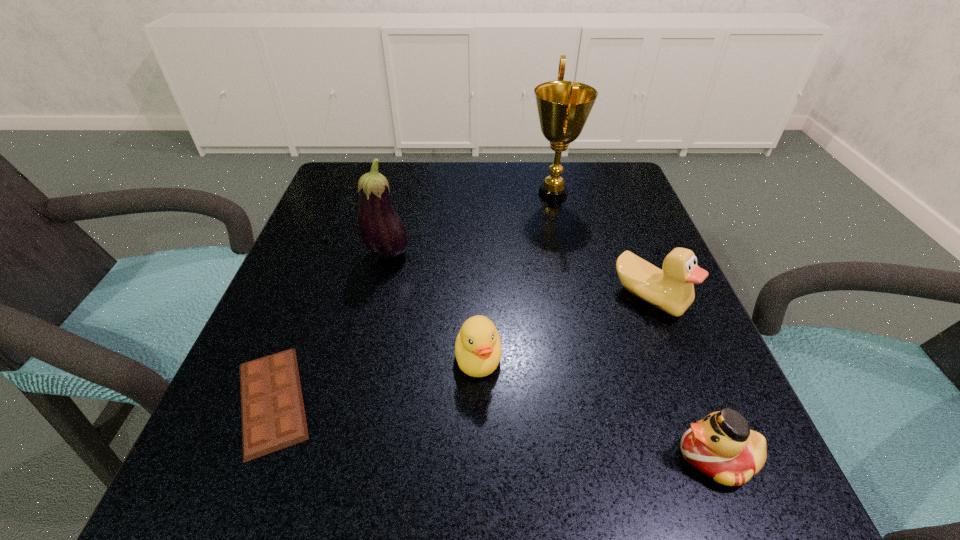
Locate an element on the screen. The image size is (960, 540). the leftmost object is located at coordinates (273, 417).

At what (x,y) coordinates should I click in order to perform the action: click on free region located on the front view with handles of the fourth object from left to right. Please return your answer as a coordinate pair (x, y). The height and width of the screenshot is (540, 960). Looking at the image, I should click on coord(397,194).

This screenshot has width=960, height=540. In order to click on vacant region located on the front view with handles of the fourth object from left to right in this screenshot , I will do `click(355, 194)`.

Identify the location of vacant space located on the front view with handles of the fourth object from left to right. The image size is (960, 540). (483, 194).

I want to click on free spot located on the back of the fifth shortest object, so click(406, 176).

Where is `free spot located 0.250m at the beak of the farthest duck`? free spot located 0.250m at the beak of the farthest duck is located at coordinates (719, 474).

This screenshot has width=960, height=540. Identify the location of vacant space located 0.140m at the beak of the fourth object from right to left. (478, 483).

At what (x,y) coordinates should I click in order to perform the action: click on vacant space located 0.350m on the face of the nearest duck. Please return your answer as a coordinate pair (x, y). The width and height of the screenshot is (960, 540). Looking at the image, I should click on (408, 457).

Locate an element on the screen. This screenshot has width=960, height=540. vacant position located on the face of the nearest duck is located at coordinates (477, 457).

The width and height of the screenshot is (960, 540). I want to click on vacant position located on the face of the nearest duck, so click(508, 457).